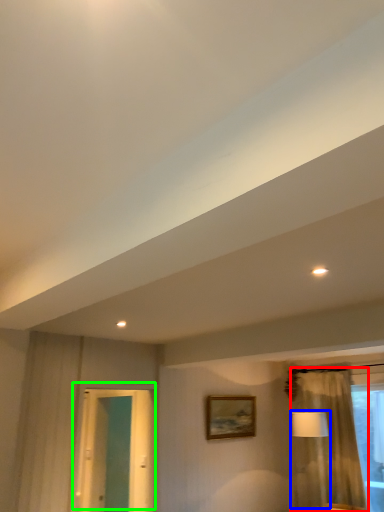
Question: Considering the real-world distances, which object is farthest from curtain (highlighted by a red box)? table lamp (highlighted by a blue box) or door (highlighted by a green box)?

Choices:
 (A) table lamp
 (B) door

Answer: (B)